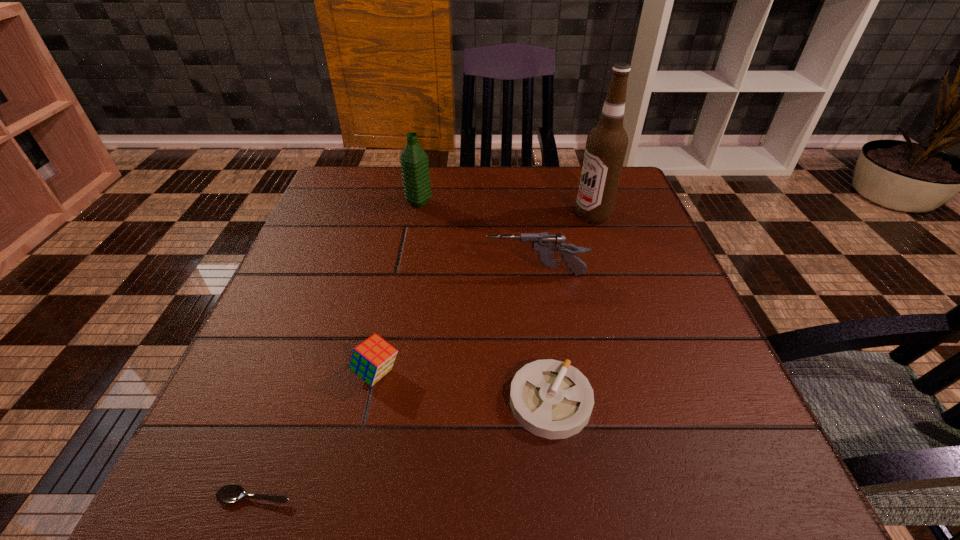
Locate an element on the screen. Image resolution: width=960 pixels, height=540 pixels. blank space located on the label of the alcohol is located at coordinates pyautogui.click(x=446, y=215).

The image size is (960, 540). I want to click on free space located 0.120m on the label of the alcohol, so click(x=527, y=215).

Identify the location of free location located 0.380m on the right of the fifth shortest object. This screenshot has height=540, width=960. (578, 202).

Where is `vacant space located 0.180m at the barrel of the fourth nearest object`? vacant space located 0.180m at the barrel of the fourth nearest object is located at coordinates (401, 275).

Where is `vacant space situated 0.120m at the barrel of the fourth nearest object`? This screenshot has width=960, height=540. vacant space situated 0.120m at the barrel of the fourth nearest object is located at coordinates (430, 275).

This screenshot has height=540, width=960. Find the location of `vacant space situated 0.280m at the barrel of the fourth nearest object`. vacant space situated 0.280m at the barrel of the fourth nearest object is located at coordinates (354, 275).

Identify the location of vacant space located on the back of the fourth tallest object. (394, 289).

In order to click on free space located on the right of the fifth tallest object in this screenshot , I will do `click(660, 401)`.

The width and height of the screenshot is (960, 540). I want to click on blank area located 0.230m on the right of the shortest object, so click(x=461, y=496).

You are a GUI agent. You are given a task and a screenshot of the screen. Output one action in this format:
    pyautogui.click(x=<x>, y=<y>)
    Task: Click on the alcohol that is at the far edge
    The width and height of the screenshot is (960, 540).
    Given the screenshot: What is the action you would take?
    pyautogui.click(x=606, y=145)